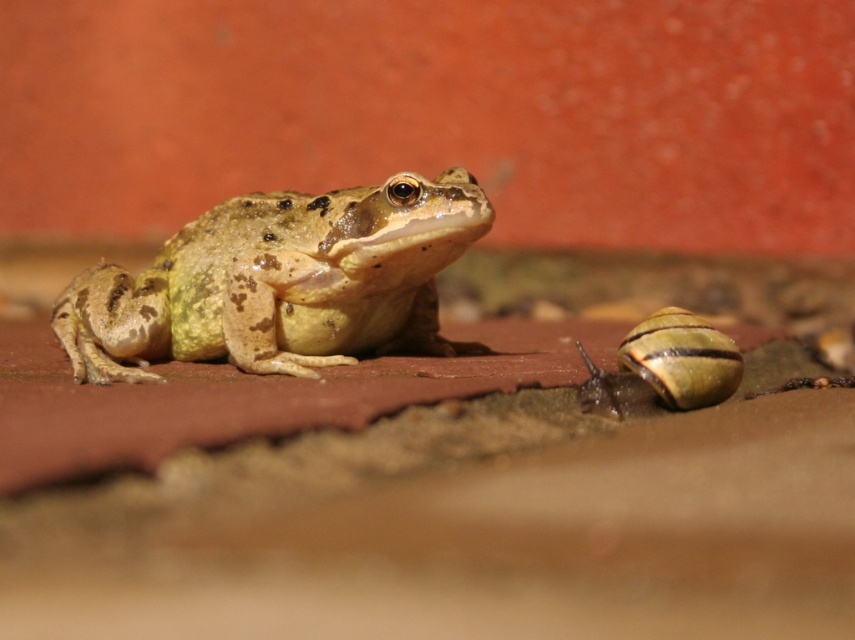
You are a small insect that wants to cross from the camouflage skin frog at center to the shiny brown shell at lower right without getting too close to either. The safe distance you need to keep is at least 5 inches from both. Is there enough space for you to do this?

The distance between the camouflage skin frog at center and the shiny brown shell at lower right is 17.02 inches. Since you need to stay at least 5 inches away from both, subtract 5 inches from each end, leaving 17.02 minus 10 equals 7.02 inches of space. This is sufficient for the insect to cross safely.

You are an entomologist observing a frog and a snail on a terracotta surface. You notice a point at coordinates (280,282). Based on the scene description, which animal is this point located on?

The point at coordinates (280,282) is located on the camouflage skin frog at center.

From the picture: You are observing a frog and a snail on a terracotta surface. You notice two points marked as point 1 and point 2. Point 1 is at coordinates (239, 291) and point 2 is at (716, 390). Based on their positions, which point is closer to you?

Point 1 at coordinates (239, 291) is closer to you than point 2 at (716, 390) because it is further to the camera.